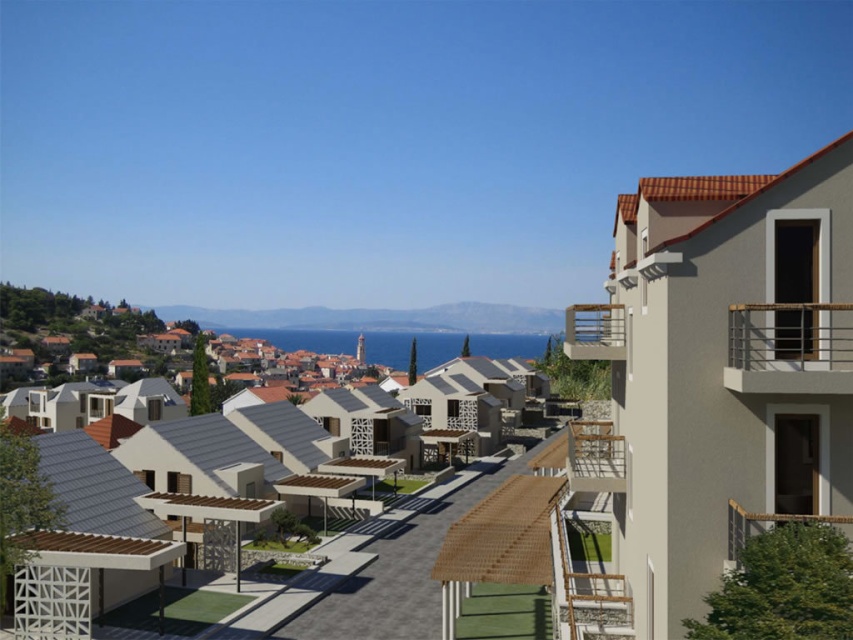
Question: Is metallic silver railing at upper right positioned at the back of brown wooden balcony at right?

Choices:
 (A) no
 (B) yes

Answer: (B)

Question: Which of the following is the closest to the observer?

Choices:
 (A) metallic silver railing at upper right
 (B) brown wooden balcony at upper right
 (C) brown wooden balcony at right

Answer: (C)

Question: Does brown wooden balcony at upper right have a larger size compared to brown wooden balcony at right?

Choices:
 (A) yes
 (B) no

Answer: (A)

Question: Can you confirm if metallic silver railing at upper right is positioned below brown wooden balcony at right?

Choices:
 (A) no
 (B) yes

Answer: (A)

Question: Which of the following is the farthest from the observer?

Choices:
 (A) brown wooden balcony at right
 (B) brown wooden balcony at upper right
 (C) metallic silver railing at upper right

Answer: (B)

Question: Which point is closer to the camera taking this photo?

Choices:
 (A) (621, 317)
 (B) (753, 531)
 (C) (787, 301)

Answer: (B)